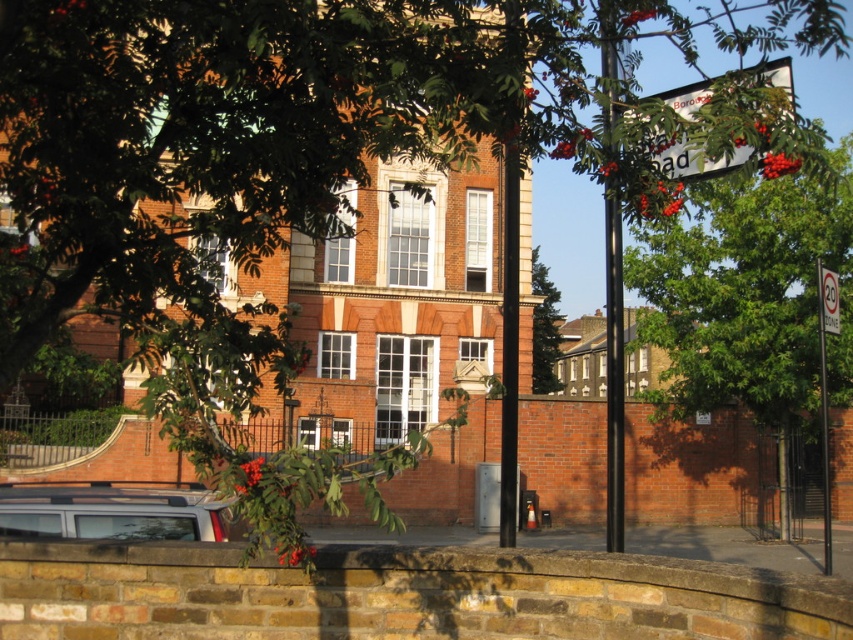
Question: Among these points, which one is farthest from the camera?

Choices:
 (A) (614, 240)
 (B) (538, 294)
 (C) (827, 291)

Answer: (B)

Question: Which of the following is the farthest from the observer?

Choices:
 (A) silver metallic car at lower left
 (B) black metal pole at center
 (C) white plastic speed limit sign at upper right

Answer: (C)

Question: Is black metal pole at right closer to the viewer compared to white plastic speed limit sign at right?

Choices:
 (A) no
 (B) yes

Answer: (B)

Question: Can you confirm if black metal pole at right is bigger than green leafy tree at center?

Choices:
 (A) yes
 (B) no

Answer: (A)

Question: Is white plastic sign at upper right positioned in front of white plastic speed limit sign at upper right?

Choices:
 (A) no
 (B) yes

Answer: (B)

Question: Which point is farther to the camera?

Choices:
 (A) white plastic speed limit sign at right
 (B) white plastic speed limit sign at upper right
 (C) black metal pole at right
 (D) silver metallic car at lower left

Answer: (A)